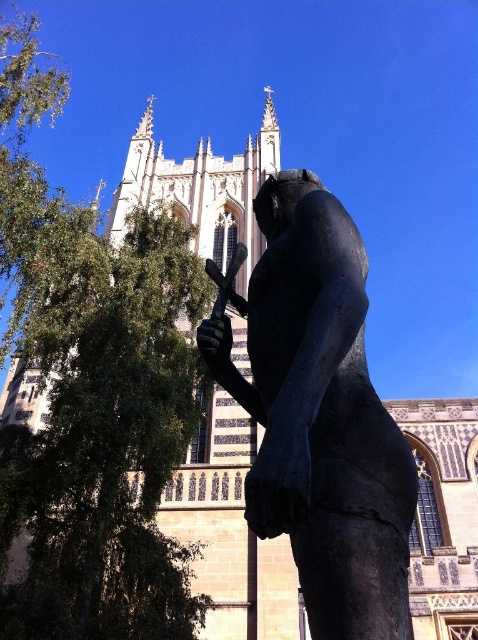
You are an artist planning to paint the scene. You want to ensure the green leafy tree at left and bronze statue at center are proportionally accurate. Which object should you paint larger?

The green leafy tree at left should be painted larger than the bronze statue at center because it is bigger than the bronze statue at center according to the description.

You are standing at the point with coordinates point (318, 385) and want to walk to the point with coordinates point (152, 497). Will the sculpture block your path?

Point (152, 497) is behind point (318, 385), so the sculpture will block your path to point (152, 497).

You are a photographer planning to capture the bronze statue at center and the green leafy tree at left in a single shot. Given that the tree is taller than the statue, how might you position your camera to ensure both subjects are fully visible in the frame?

Since the green leafy tree at left is taller than the bronze statue at center, positioning the camera lower to the ground would help include the full height of both subjects in the frame.